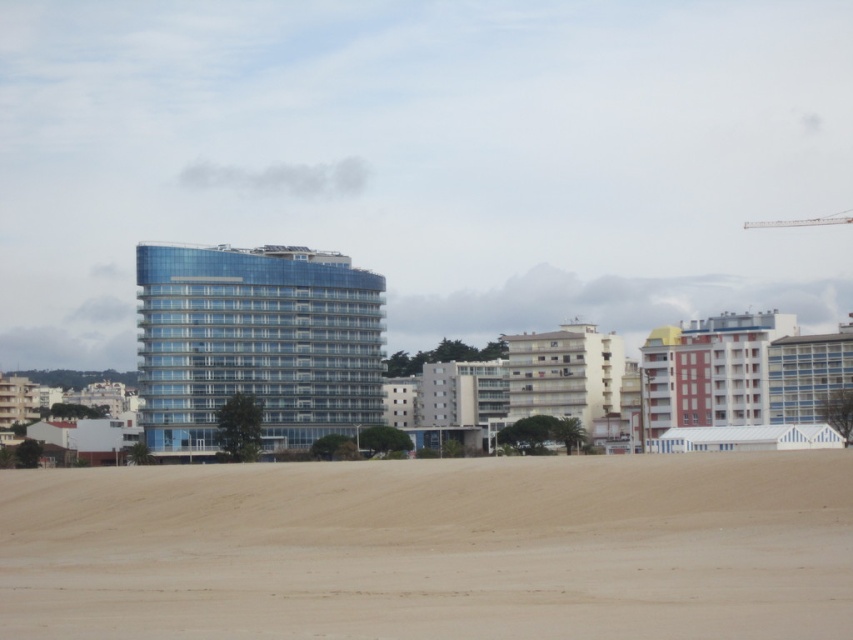
You are standing at the point marked as point (434, 548) on the beach. Based on the scene description, what is the immediate surface you are standing on?

The point (434, 548) indicates the beige sandy beach at lower center, so you are standing on the beige sandy beach at lower center.

You are standing on the beige sandy beach at lower center and want to take a photo of the tall glass building in the midground. Since the beach is at a specific coordinate, can you estimate how far you are from the base of the tall glass building?

The beige sandy beach at lower center is located at point (x=434, y=548). Since the tall glass building is in the midground, it is farther away than the beach but closer than the background buildings. However, without additional distance markers or scale references, it is impossible to provide an exact distance in meters or feet. The exact distance cannot be determined from the given information.